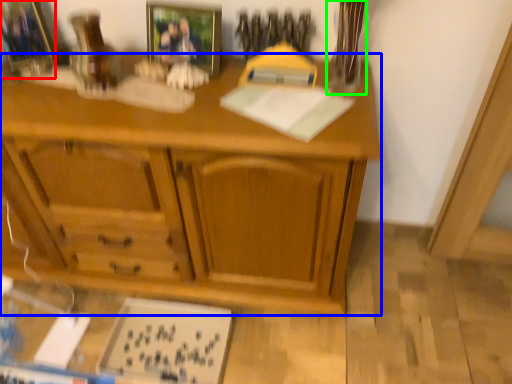
Question: Which object is the farthest from picture frame (highlighted by a red box)? Choose among these: desk (highlighted by a blue box) or glass vase (highlighted by a green box).

Choices:
 (A) desk
 (B) glass vase

Answer: (B)